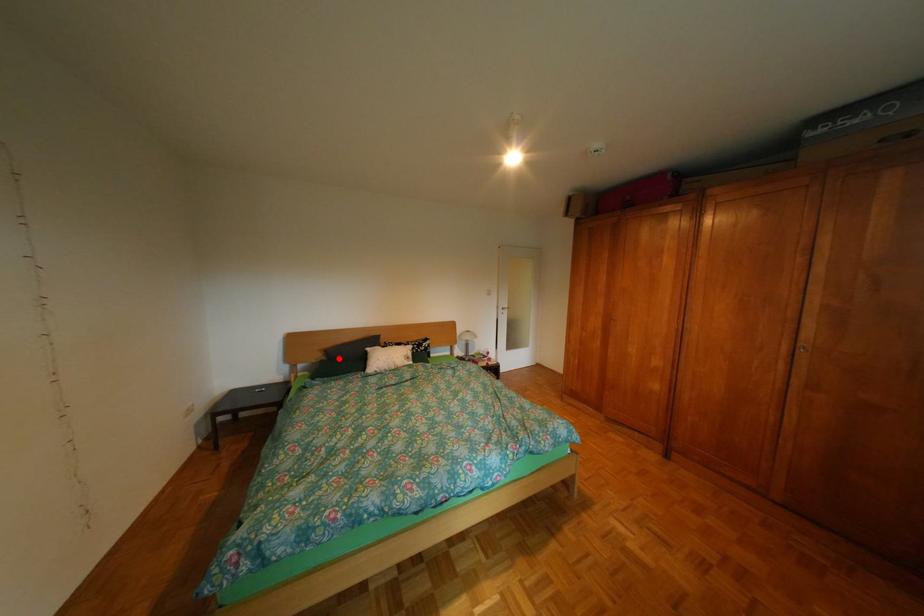
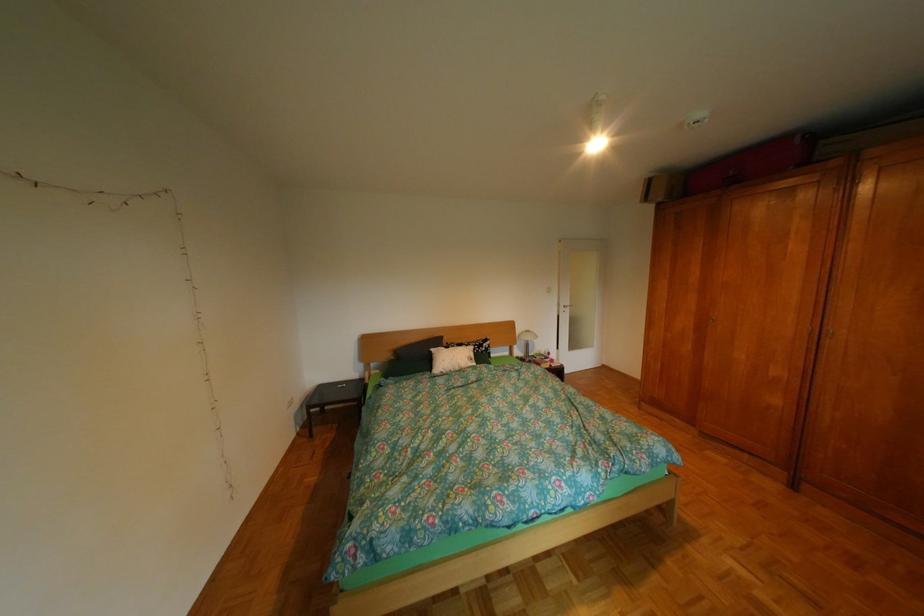
Question: I am providing you with two images of the same scene from different viewpoints. A red point is marked on the first image. At the location where the point appears in image 1, is it still visible in image 2?

Choices:
 (A) Yes
 (B) No

Answer: (A)